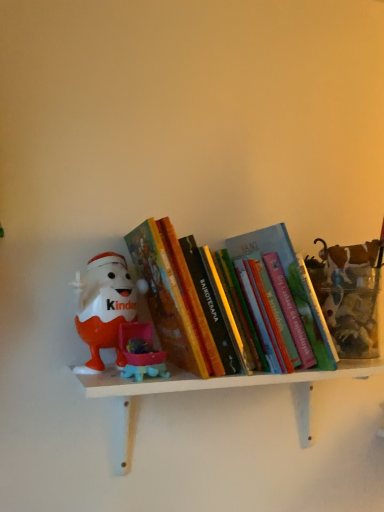
Question: From a real-world perspective, is white matte shelf at center above or below hardcover book at center?

Choices:
 (A) below
 (B) above

Answer: (A)

Question: From the image's perspective, is white matte shelf at center above or below hardcover book at center?

Choices:
 (A) below
 (B) above

Answer: (A)

Question: Based on their relative distances, which object is farther from the matte plastic kinder egg at left?

Choices:
 (A) hardcover book at center
 (B) white matte shelf at center

Answer: (B)

Question: Which object is positioned farthest from the hardcover book at center?

Choices:
 (A) matte plastic kinder egg at left
 (B) white matte shelf at center

Answer: (B)